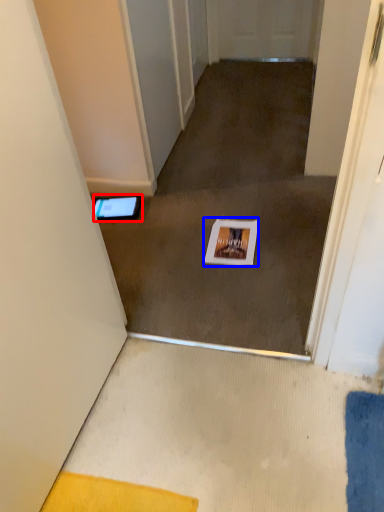
Question: Which of the following is the closest to the observer, tablet computer (highlighted by a red box) or postcard (highlighted by a blue box)?

Choices:
 (A) tablet computer
 (B) postcard

Answer: (B)